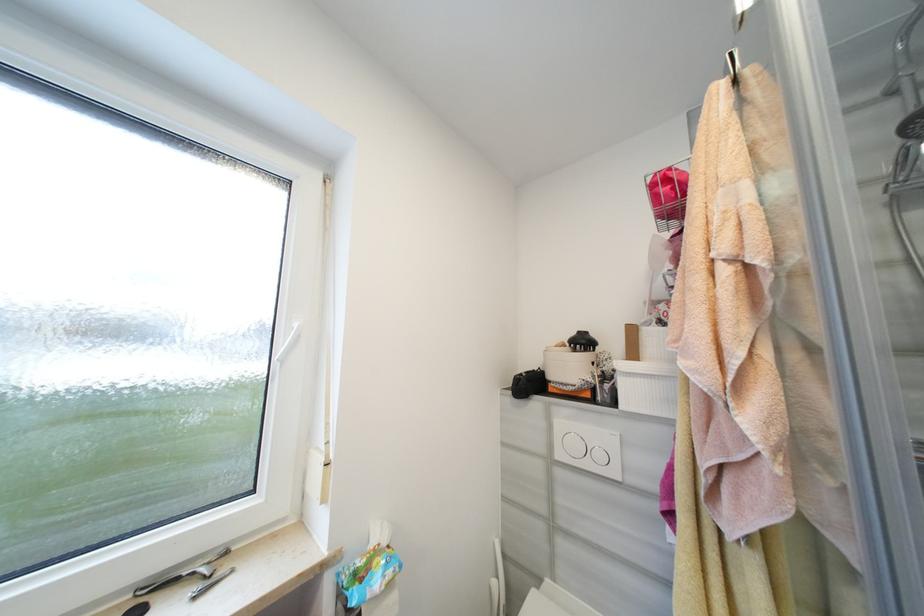
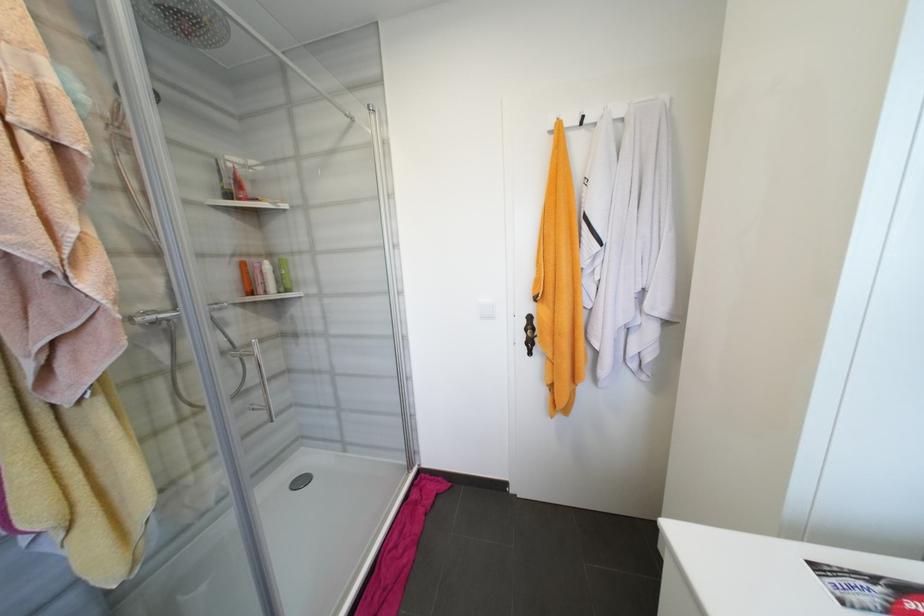
Question: The camera is either moving clockwise (left) or counter-clockwise (right) around the object. The first image is from the beginning of the video and the second image is from the end. Is the camera moving left or right when shooting the video?

Choices:
 (A) Left
 (B) Right

Answer: (A)